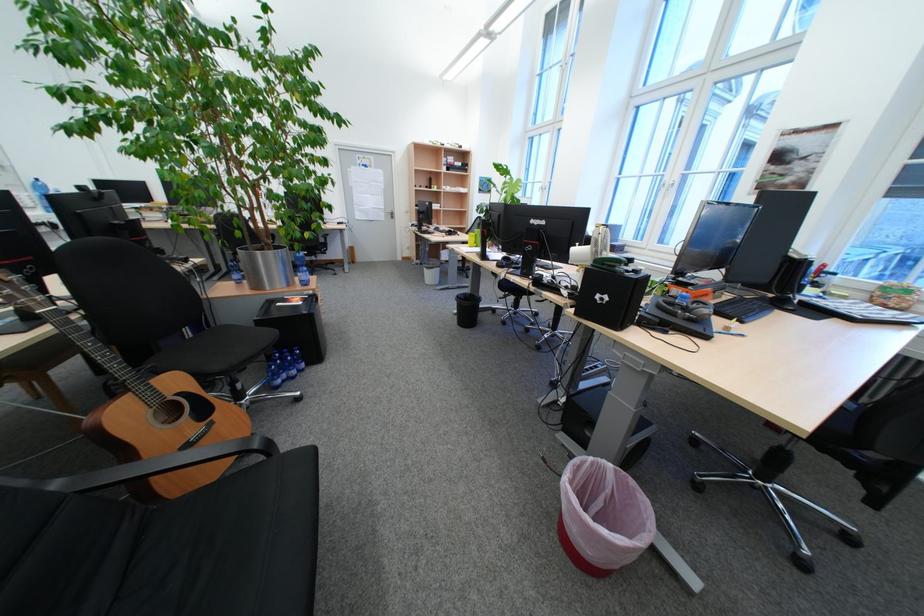
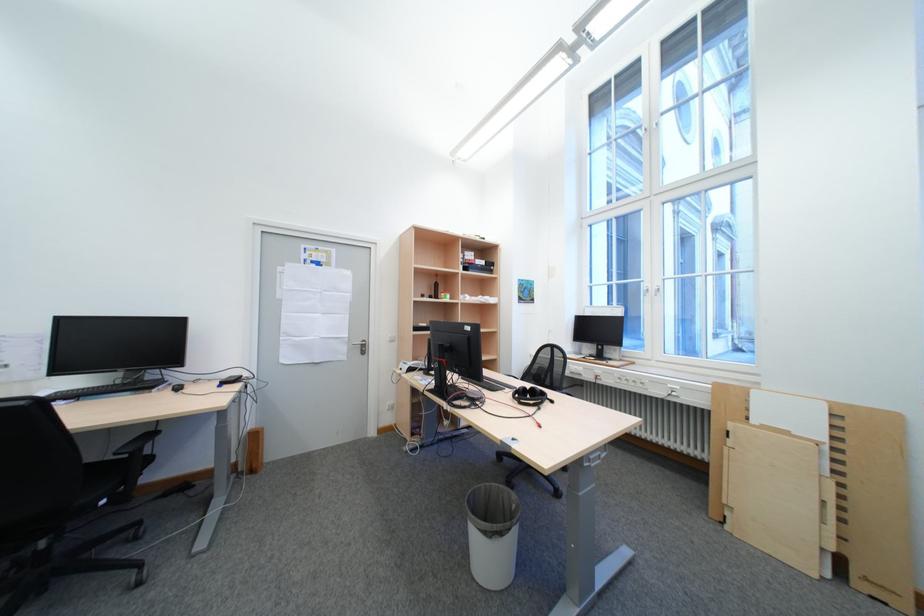
Where in the second image is the point corresponding to point 435,182 from the first image?

(436, 290)